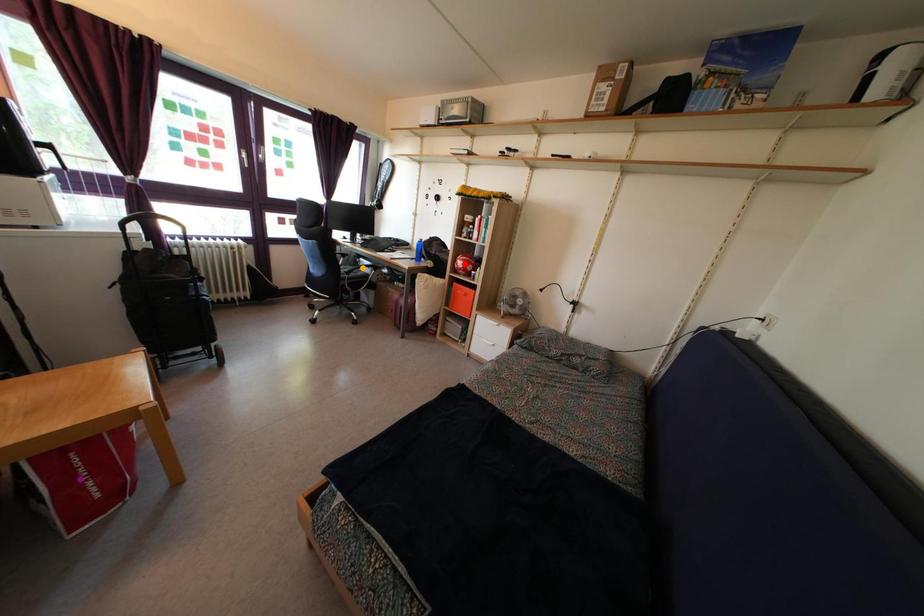
Order these from nearest to farthest:
red point
orange point
purple point

orange point → red point → purple point